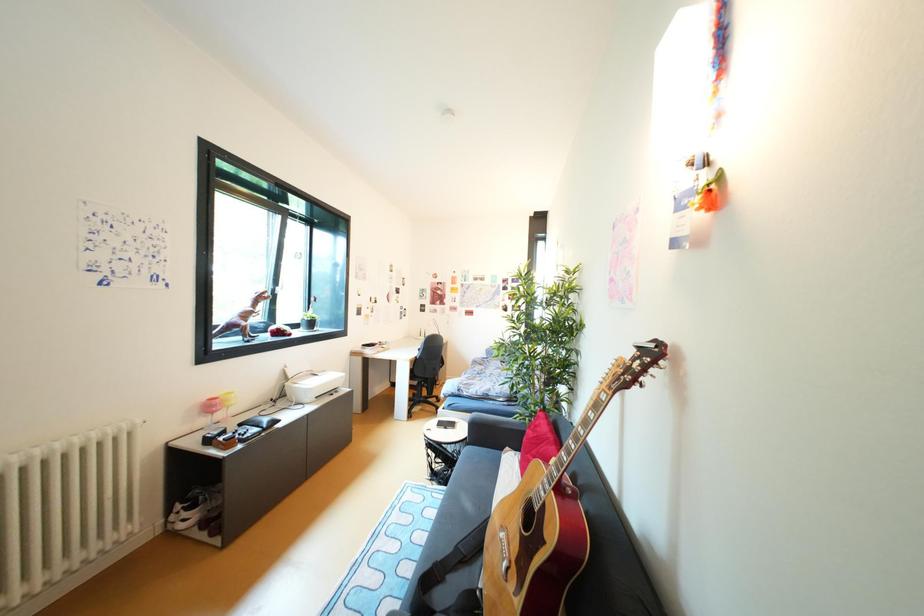
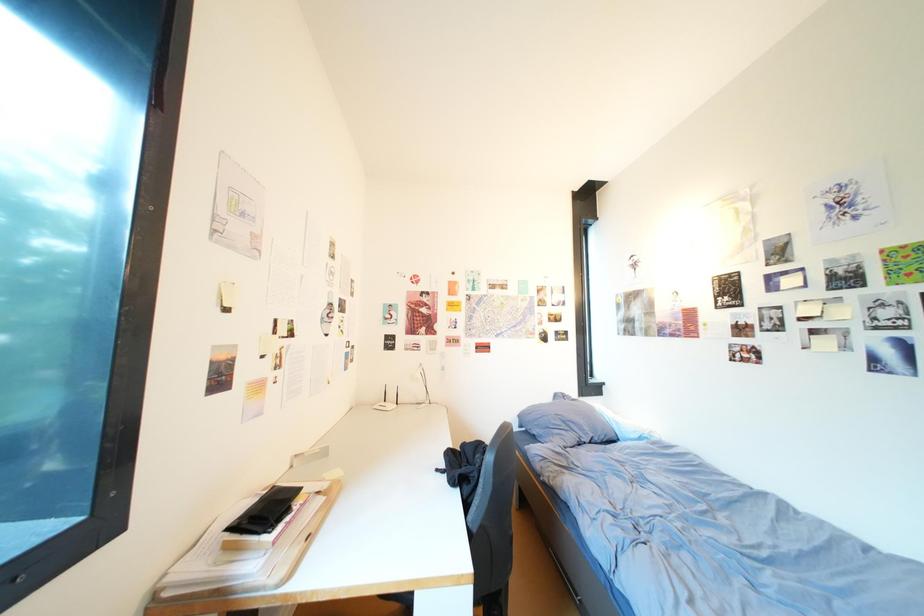
The images are taken continuously from a first-person perspective. In which direction are you moving?

The cameraman moved toward left, forward.